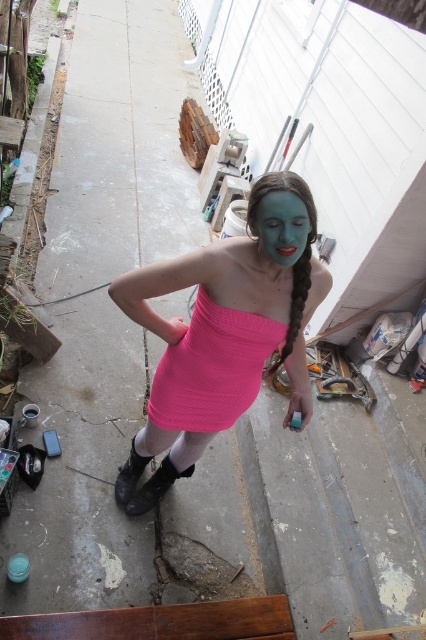
Who is shorter, pink matte dress at center or pink ribbed dress at center?

pink ribbed dress at center is shorter.

Is pink matte dress at center to the left of pink ribbed dress at center from the viewer's perspective?

Yes, pink matte dress at center is to the left of pink ribbed dress at center.

The width and height of the screenshot is (426, 640). Describe the element at coordinates (224, 332) in the screenshot. I see `pink matte dress at center` at that location.

Identify the location of pink matte dress at center. This screenshot has height=640, width=426. (x=224, y=332).

Who is positioned more to the left, blue matte face at center or blue matte pigtail at center?

blue matte face at center

Is point (276, 262) less distant than point (296, 317)?

Yes, it is.

Locate an element on the screen. This screenshot has width=426, height=640. blue matte face at center is located at coordinates (281, 227).

Locate an element on the screen. The image size is (426, 640). blue matte face at center is located at coordinates (281, 227).

How far apart are pink matte dress at center and blue matte face at center?

pink matte dress at center and blue matte face at center are 16.06 inches apart from each other.

Identify the location of pink matte dress at center. This screenshot has width=426, height=640. (224, 332).